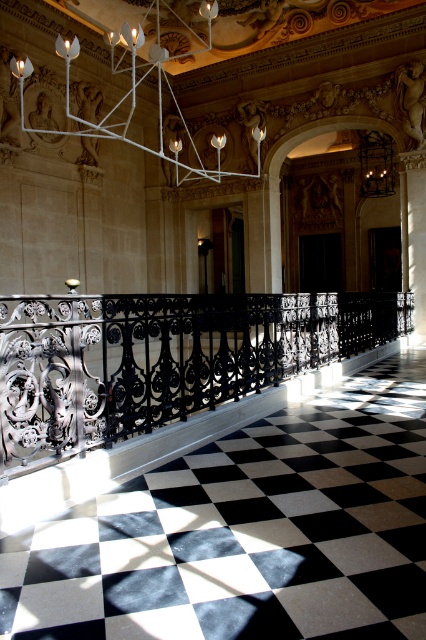
You are an interior designer assessing the space for safety compliance. You need to ensure that the black wrought iron railing at center and the white metal chandelier at upper center meet the minimum clearance requirement of 2 meters between them. Can you confirm if this requirement is met based on their positions?

The black wrought iron railing at center is located below the white metal chandelier at upper center, but the exact distance between them is not specified. Therefore, it is impossible to confirm if the 2 meters clearance requirement is met without additional information.

You are standing in the grand hall and want to touch the black wrought iron railing at center. Based on its coordinates, which direction should you move to reach it?

The black wrought iron railing at center is located at point [163,358], so you should move towards the center of the room to reach it.

You are an interior designer assessing the space. You need to determine if the black wrought iron railing at center can be moved to the location currently occupied by the white metal chandelier at upper center. Based on their sizes, is this feasible?

The black wrought iron railing at center occupies less space than the white metal chandelier at upper center, so it can be moved to the location of the white metal chandelier at upper center since it requires less space.